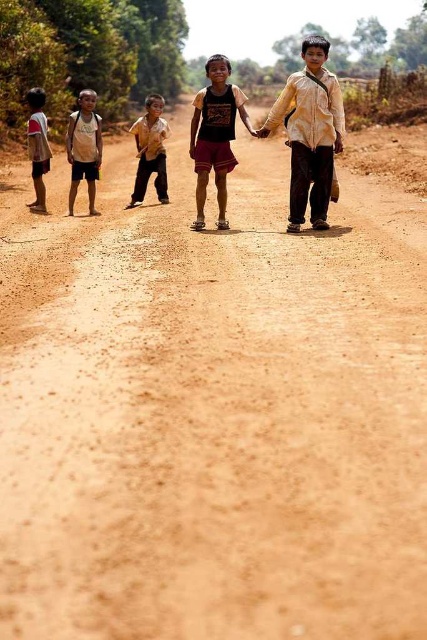
Between dark brown cotton shorts at center and light brown cotton shirt at left, which one appears on the left side from the viewer's perspective?

Positioned to the left is light brown cotton shirt at left.

Who is lower down, dark brown cotton shorts at center or light brown cotton shirt at left?

light brown cotton shirt at left is below.

Who is more forward, (233,113) or (32,99)?

Point (233,113) is in front.

What are the coordinates of `dark brown cotton shorts at center` in the screenshot? It's located at (215, 134).

Can you confirm if white cotton shirt at left is positioned below brown cotton shirt at center?

Yes.

Does white cotton shirt at left have a larger size compared to brown cotton shirt at center?

No, white cotton shirt at left is not bigger than brown cotton shirt at center.

Is point (70, 211) farther from camera compared to point (143, 156)?

That is False.

The width and height of the screenshot is (427, 640). What are the coordinates of `white cotton shirt at left` in the screenshot? It's located at (84, 148).

Does yellow cotton shirt at center have a lesser width compared to white cotton shirt at left?

Yes.

Does point (312, 60) come closer to viewer compared to point (78, 173)?

Yes.

This screenshot has width=427, height=640. I want to click on yellow cotton shirt at center, so click(x=310, y=132).